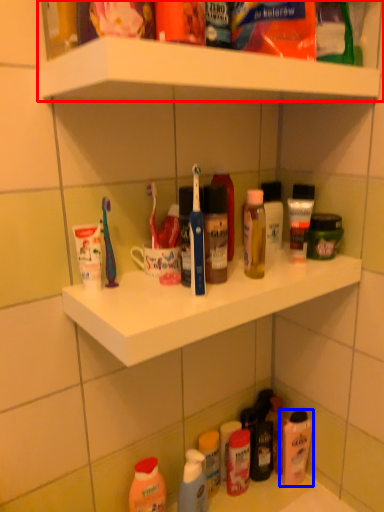
Question: Which of the following is the closest to the observer, shelf (highlighted by a red box) or cleaning product (highlighted by a blue box)?

Choices:
 (A) shelf
 (B) cleaning product

Answer: (A)